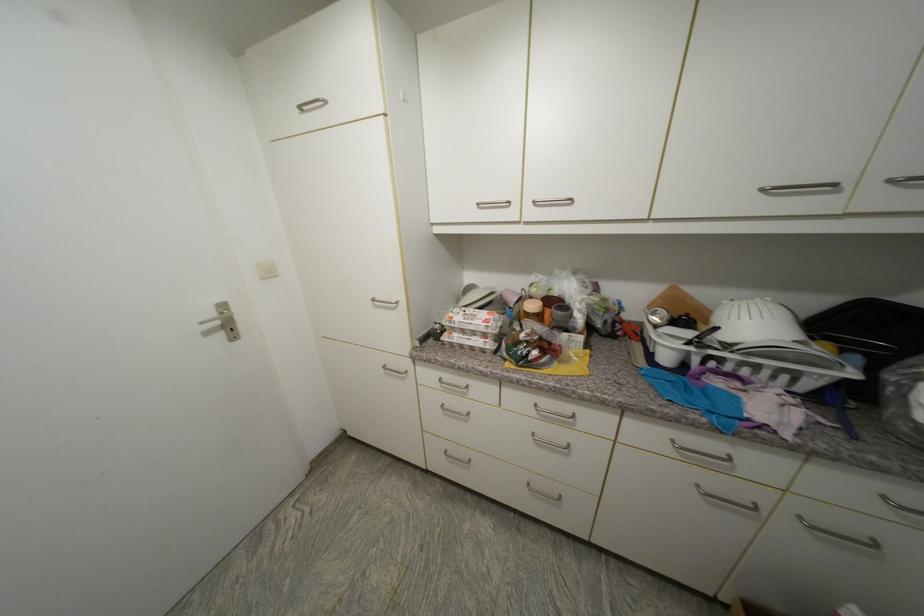
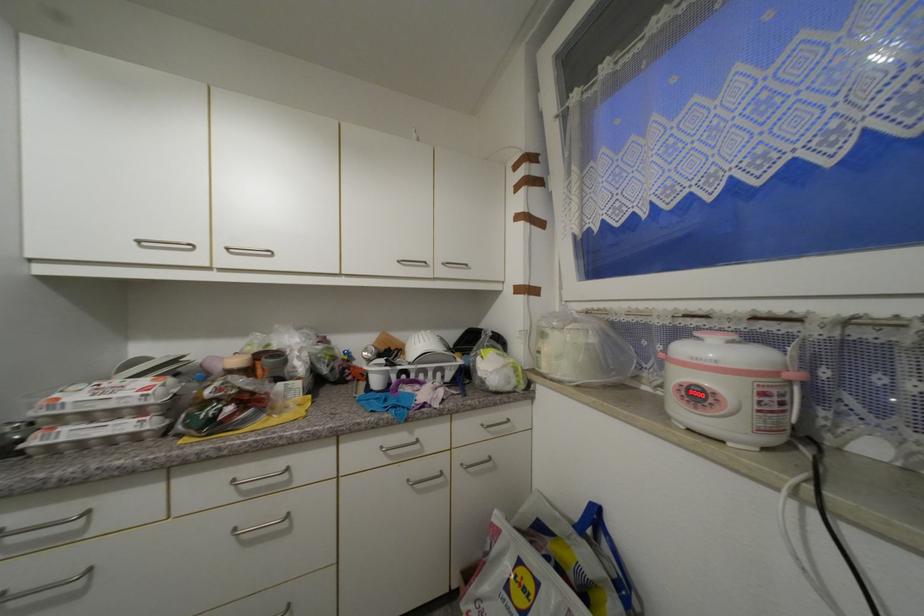
In the second image, find the point that corresponds to (540,436) in the first image.

(240, 531)